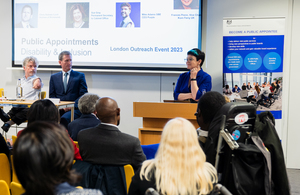
Identify the location of poster on wall. (267, 26).